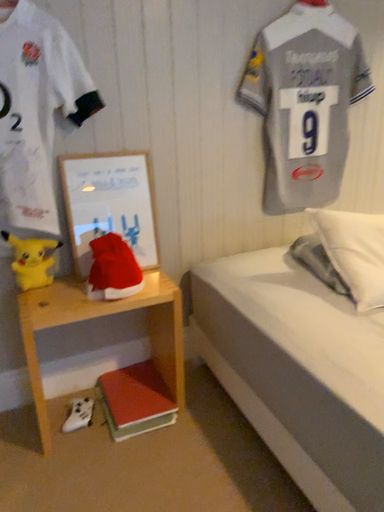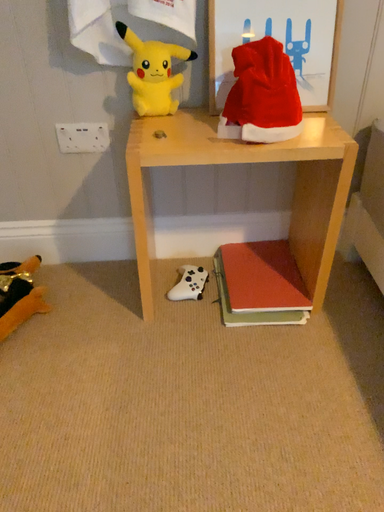
Question: Which way did the camera rotate in the video?

Choices:
 (A) rotated downward
 (B) rotated upward

Answer: (A)